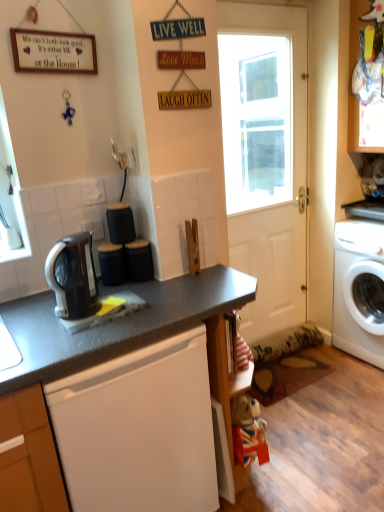
At what (x,y) coordinates should I click in order to perform the action: click on vacant space to the right of black fabric ottoman at center, the 2th appliance from the left. Please return your answer as a coordinate pair (x, y). The image size is (384, 512). Looking at the image, I should click on (187, 276).